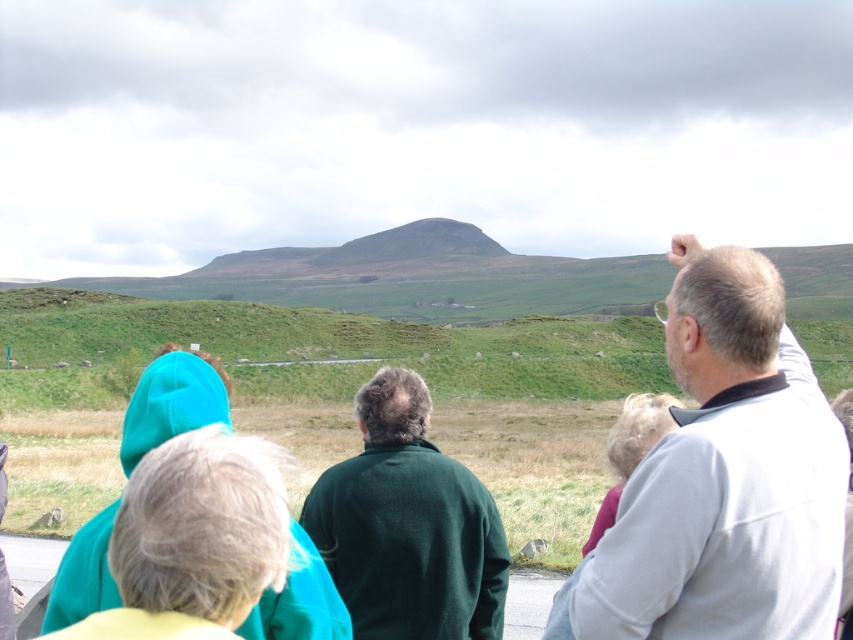
You are organizing a group photo and need to arrange the gray fleece jacket at upper right and dark green sweater at center so that both fit within a 2m wide frame. Given their widths, which one should be placed closer to the edge to avoid overlapping?

The gray fleece jacket at upper right is wider than the dark green sweater at center. To fit both within the 2m frame, place the wider gray fleece jacket at upper right closer to one edge and the narrower dark green sweater at center towards the center to prevent overlapping.

You are part of a hiking group and notice two people in the scene. One is wearing a gray fleece jacket at upper right and the other a dark green sweater at center. From your vantage point, which person is positioned higher up in the landscape?

The gray fleece jacket at upper right is positioned higher up in the landscape than the dark green sweater at center.

You are a photographer trying to capture a group photo of the gray fleece jacket at upper right and the dark green sweater at center. The camera you are using has a minimum focusing distance of 2 meters. Will you be able to take a clear photo of both subjects without moving them?

The distance between the gray fleece jacket at upper right and the dark green sweater at center is 1.78 meters. Since the camera requires a minimum focusing distance of 2 meters, you will need to move back further or have the subjects move apart to ensure both are in focus.